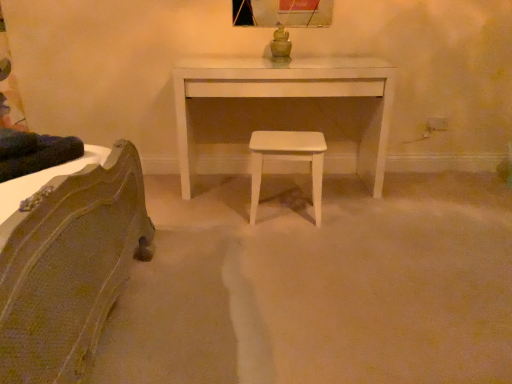
Question: From the image's perspective, is white wood stool at center beneath white matte table at center?

Choices:
 (A) yes
 (B) no

Answer: (A)

Question: Is white wood stool at center not near white matte table at center?

Choices:
 (A) yes
 (B) no

Answer: (B)

Question: Is white wood stool at center aimed at white matte table at center?

Choices:
 (A) yes
 (B) no

Answer: (B)

Question: Can you confirm if white wood stool at center is positioned to the left of white matte table at center?

Choices:
 (A) no
 (B) yes

Answer: (A)

Question: From the image's perspective, is white wood stool at center over white matte table at center?

Choices:
 (A) yes
 (B) no

Answer: (B)

Question: Is white wood stool at center smaller than white matte table at center?

Choices:
 (A) yes
 (B) no

Answer: (A)

Question: Considering the relative sizes of white matte table at center and white wood stool at center in the image provided, is white matte table at center bigger than white wood stool at center?

Choices:
 (A) yes
 (B) no

Answer: (A)

Question: From a real-world perspective, does white matte table at center stand above white wood stool at center?

Choices:
 (A) no
 (B) yes

Answer: (B)

Question: Is white matte table at center positioned in front of white wood stool at center?

Choices:
 (A) yes
 (B) no

Answer: (B)

Question: From the image's perspective, does white matte table at center appear lower than white wood stool at center?

Choices:
 (A) yes
 (B) no

Answer: (B)

Question: Can you confirm if white matte table at center is wider than white wood stool at center?

Choices:
 (A) no
 (B) yes

Answer: (B)

Question: Is the position of white matte table at center more distant than that of white wood stool at center?

Choices:
 (A) yes
 (B) no

Answer: (A)

Question: From a real-world perspective, is white wood stool at center physically located above or below white matte table at center?

Choices:
 (A) above
 (B) below

Answer: (B)